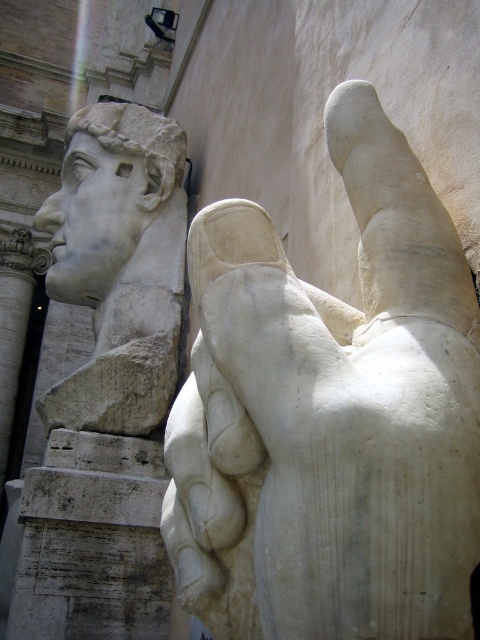
Is point (462, 484) farther from camera compared to point (118, 179)?

No, (462, 484) is in front of (118, 179).

Does white marble hand at center have a lesser width compared to white marble head at upper left?

Correct, white marble hand at center's width is less than white marble head at upper left's.

The height and width of the screenshot is (640, 480). What do you see at coordinates (331, 413) in the screenshot?
I see `white marble hand at center` at bounding box center [331, 413].

This screenshot has width=480, height=640. In order to click on white marble hand at center in this screenshot , I will do `click(331, 413)`.